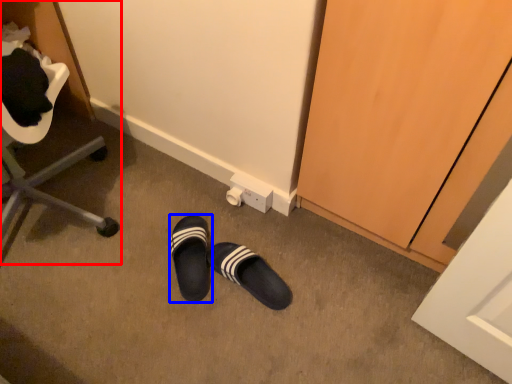
Question: Which object is further to the camera taking this photo, furniture (highlighted by a red box) or footwear (highlighted by a blue box)?

Choices:
 (A) furniture
 (B) footwear

Answer: (B)